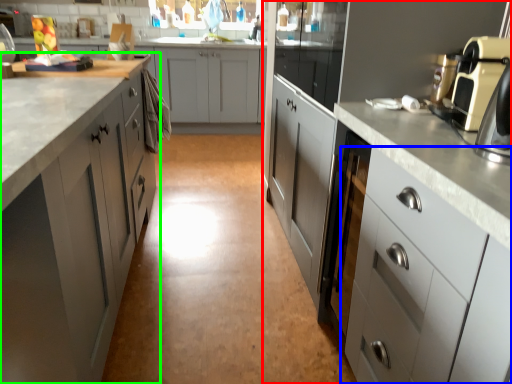
Question: Which object is the closest to the cabinetry (highlighted by a red box)? Choose among these: cabinetry (highlighted by a blue box) or cabinetry (highlighted by a green box).

Choices:
 (A) cabinetry
 (B) cabinetry

Answer: (A)